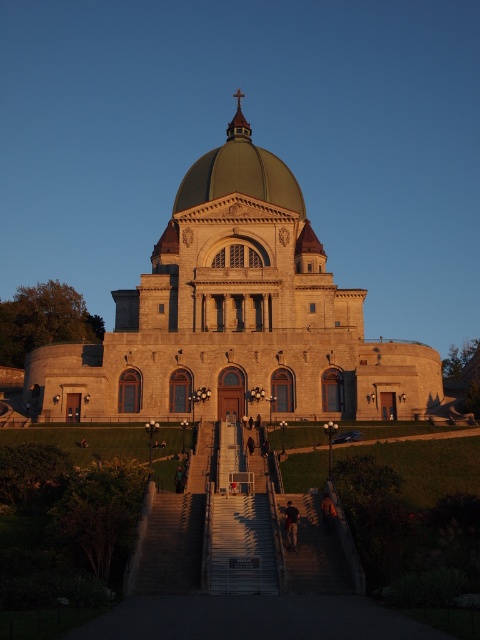
You are standing in front of the historic building described. You notice the green matte dome at center and the dark blue jeans at center. Which object is positioned higher in the scene?

The green matte dome at center is located above the dark blue jeans at center, so it is positioned higher in the scene.

You are standing at the entrance of the cathedral and want to take a photo of the dome. The camera you are using has a maximum zoom range of 100 feet. Is the point at coordinates point [240,161] within the camera range?

The point at coordinates point [240,161] is 352.14 feet away from the camera. Since the camera can only zoom up to 100 feet, the point is outside the camera range.